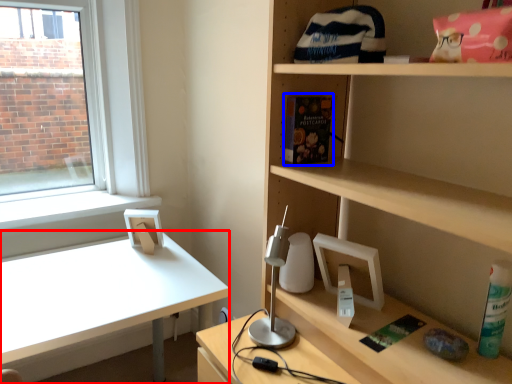
Question: Which of the following is the closest to the observer, desk (highlighted by a red box) or book (highlighted by a blue box)?

Choices:
 (A) desk
 (B) book

Answer: (B)